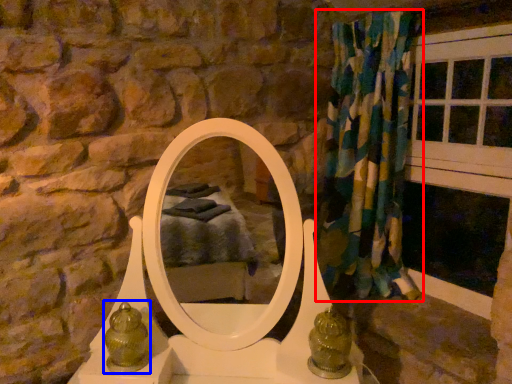
Question: Which object is further to the camera taking this photo, curtain (highlighted by a red box) or antique (highlighted by a blue box)?

Choices:
 (A) curtain
 (B) antique

Answer: (A)